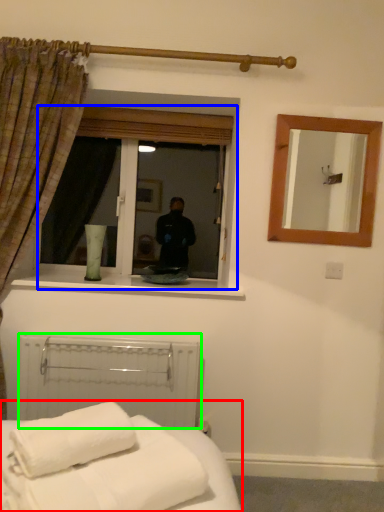
Question: Which is nearer to the bed (highlighted by a red box)? window (highlighted by a blue box) or balustrade (highlighted by a green box).

Choices:
 (A) window
 (B) balustrade

Answer: (B)